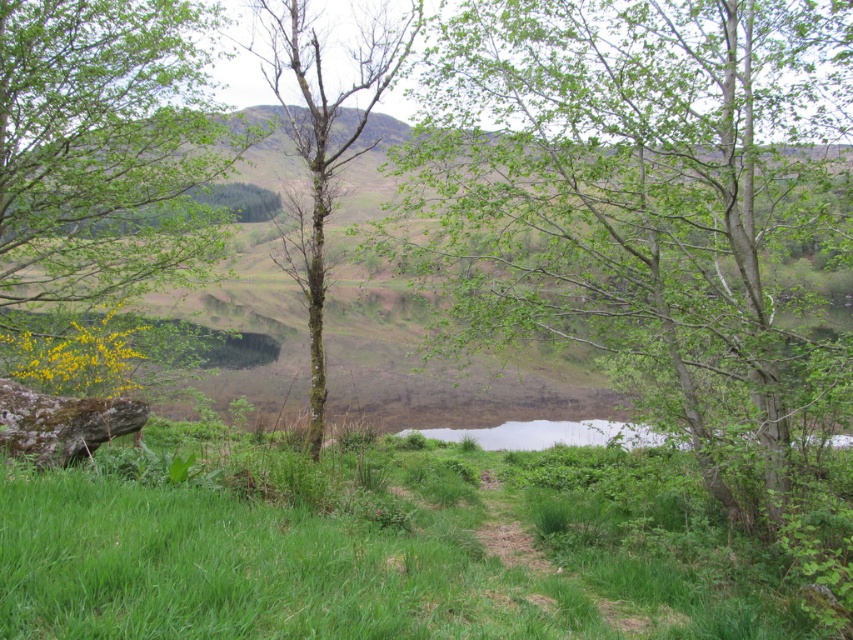
Question: Which of these objects is positioned closest to the green leafy tree at left?

Choices:
 (A) bare bark tree at center
 (B) green grassy at center
 (C) green leafy tree at center

Answer: (A)

Question: Can you confirm if green leafy tree at center is positioned to the right of bare bark tree at center?

Choices:
 (A) no
 (B) yes

Answer: (B)

Question: Which of these objects is positioned farthest from the bare bark tree at center?

Choices:
 (A) green leafy tree at left
 (B) green grassy at center
 (C) green leafy tree at center

Answer: (A)

Question: Can you confirm if green grassy at center is positioned to the right of bare bark tree at center?

Choices:
 (A) no
 (B) yes

Answer: (B)

Question: Which point appears closest to the camera in this image?

Choices:
 (A) (74, 488)
 (B) (354, 141)
 (C) (635, 40)

Answer: (A)

Question: Does green leafy tree at center appear under bare bark tree at center?

Choices:
 (A) yes
 (B) no

Answer: (A)